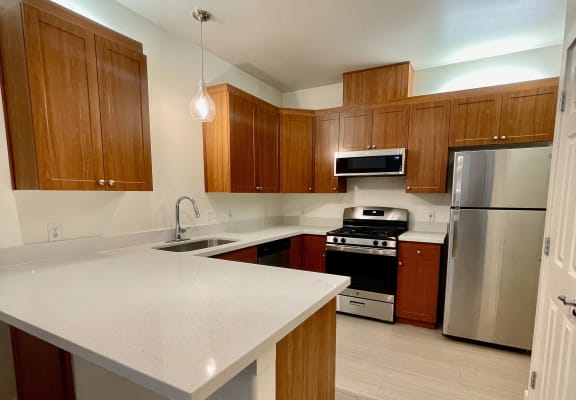
This screenshot has height=400, width=576. Find the location of `faucet`. faucet is located at coordinates (177, 203).